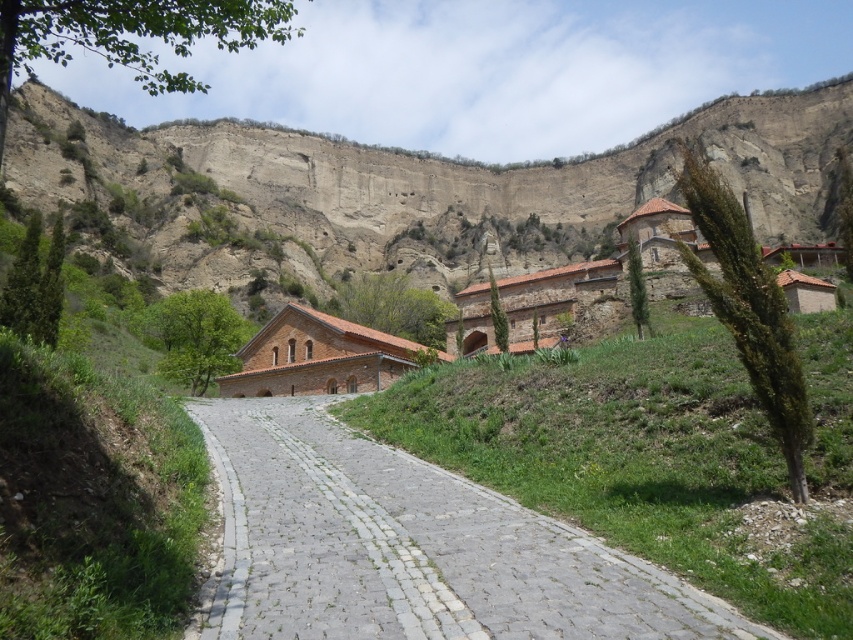
Is rustic stone cliff at upper center positioned behind gray cobblestone path at center?

Yes, rustic stone cliff at upper center is behind gray cobblestone path at center.

Which is in front, point (389, 246) or point (399, 563)?

Point (399, 563) is more forward.

Between point (727, 148) and point (624, 556), which one is positioned behind?

The point (727, 148) is more distant.

This screenshot has height=640, width=853. I want to click on rustic stone cliff at upper center, so click(401, 192).